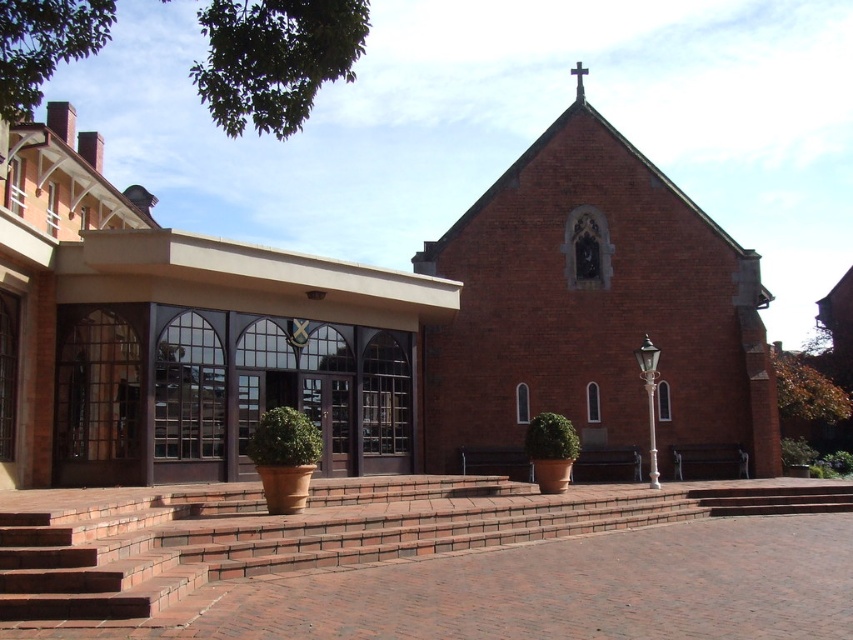
Question: Can you confirm if brick church at center is positioned to the left of brick stairs at center?

Choices:
 (A) no
 (B) yes

Answer: (B)

Question: Which point is closer to the camera?

Choices:
 (A) (723, 278)
 (B) (606, 404)

Answer: (B)

Question: Among these points, which one is nearest to the camera?

Choices:
 (A) (585, 115)
 (B) (611, 516)
 (C) (753, 269)

Answer: (B)

Question: Where is brick church at center located in relation to brick stairs at center in the image?

Choices:
 (A) below
 (B) above

Answer: (B)

Question: Where is brick chapel at center located in relation to brick stairs at center in the image?

Choices:
 (A) below
 (B) above

Answer: (B)

Question: Which point is closer to the camera taking this photo?

Choices:
 (A) (639, 180)
 (B) (605, 493)
 (C) (102, 483)

Answer: (C)